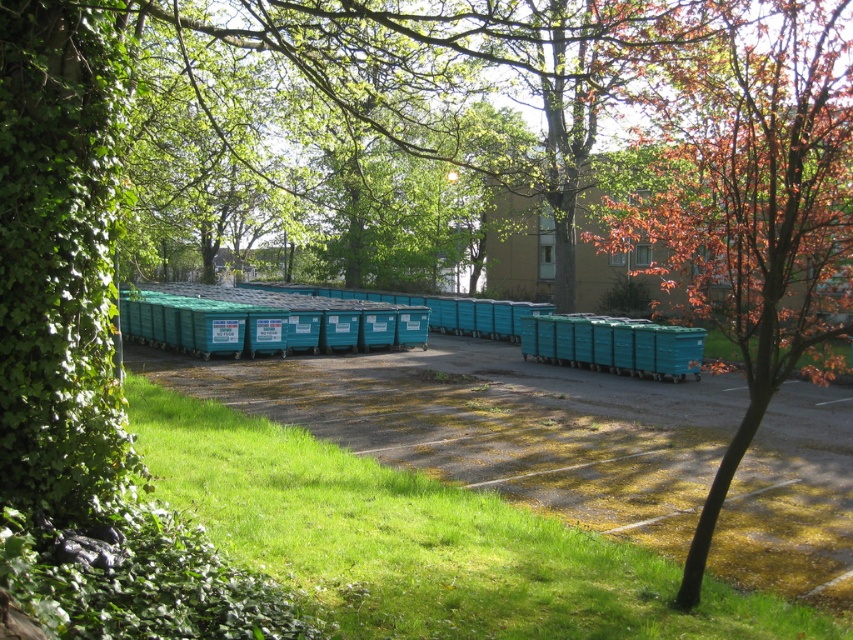
Does green grass at lower left appear over reddish-brown bark tree at right?

Incorrect, green grass at lower left is not positioned above reddish-brown bark tree at right.

Can you confirm if green grass at lower left is bigger than reddish-brown bark tree at right?

Incorrect, green grass at lower left is not larger than reddish-brown bark tree at right.

Between point (410, 596) and point (744, 348), which one is positioned behind?

The point (744, 348) is behind.

This screenshot has width=853, height=640. Identify the location of green grass at lower left. (422, 541).